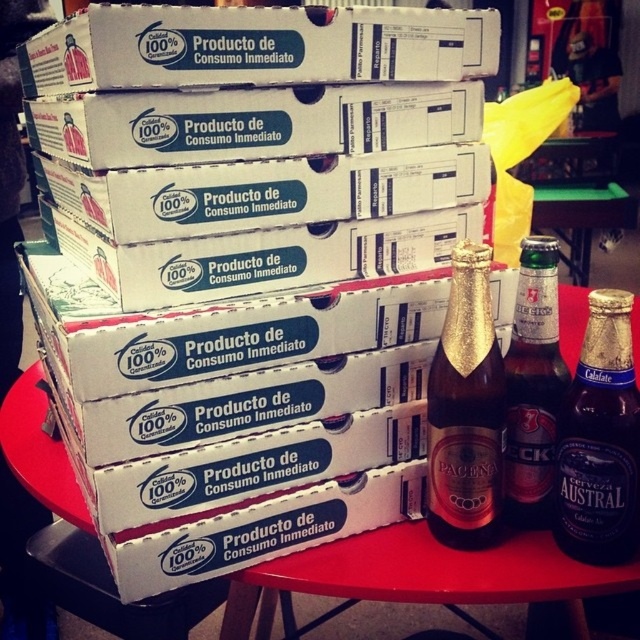
Question: Where is dark glass bottle at center right located in relation to green glass bottle at center right in the image?

Choices:
 (A) below
 (B) above

Answer: (A)

Question: Which of the following is the closest to the observer?

Choices:
 (A) dark glass bottle at center right
 (B) green glass bottle at center right
 (C) gold foil beer bottle at center

Answer: (A)

Question: Among these objects, which one is farthest from the camera?

Choices:
 (A) dark glass bottle at center right
 (B) gold foil beer bottle at center
 (C) green glass bottle at center right

Answer: (C)

Question: Does gold foil beer bottle at center appear on the left side of green glass bottle at center right?

Choices:
 (A) yes
 (B) no

Answer: (A)

Question: Can you confirm if gold foil beer bottle at center is wider than dark glass bottle at center right?

Choices:
 (A) yes
 (B) no

Answer: (B)

Question: Considering the real-world distances, which object is closest to the green glass bottle at center right?

Choices:
 (A) gold foil beer bottle at center
 (B) dark glass bottle at center right

Answer: (B)